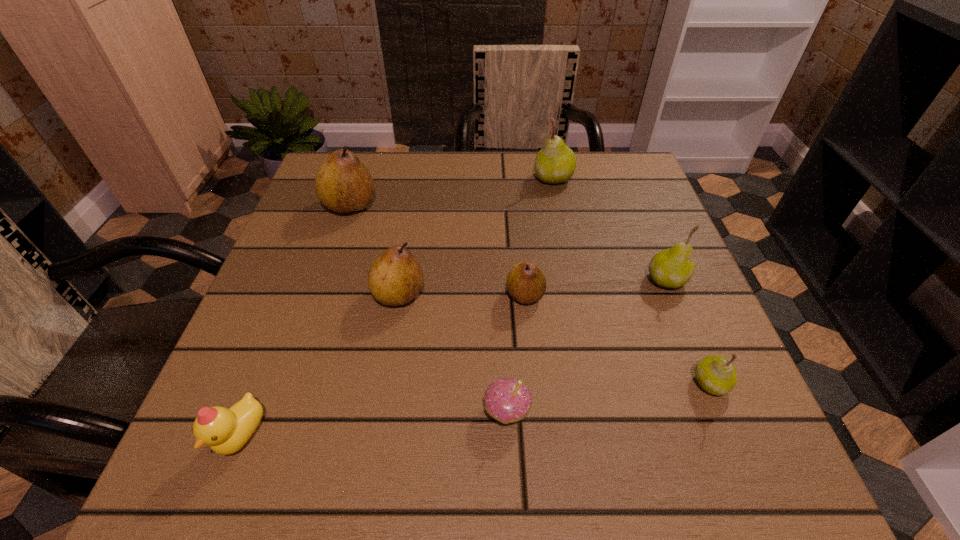
This screenshot has width=960, height=540. What are the coordinates of `the nearest green pear` in the screenshot? It's located at (716, 375).

Locate an element on the screen. pink cupcake is located at coordinates (507, 400).

Identify the location of duckling. (226, 431).

You are a GUI agent. You are given a task and a screenshot of the screen. Output one action in this format:
    pyautogui.click(x=<x>, y=<y>)
    Task: Click on the vacant point located 0.400m on the front of the farthest object
    This screenshot has height=540, width=960.
    Given the screenshot: What is the action you would take?
    pyautogui.click(x=583, y=321)

Find the location of a particular element. Image resolution: width=960 pixels, height=540 pixels. vacant area situated on the front of the second farthest object is located at coordinates (293, 376).

Find the location of a particular element. This screenshot has height=540, width=960. free space located on the back of the second pear from left to right is located at coordinates (406, 252).

Find the location of a particular element. The image size is (960, 540). free space located 0.340m on the back of the second farthest green pear is located at coordinates (622, 172).

The width and height of the screenshot is (960, 540). I want to click on vacant region located on the back of the smallest brown pear, so click(x=514, y=172).

You are a GUI agent. You are given a task and a screenshot of the screen. Output one action in this format:
    pyautogui.click(x=<x>, y=<y>)
    Task: Click on the vacant space situated 0.370m on the left of the smallest green pear
    
    Given the screenshot: What is the action you would take?
    pyautogui.click(x=458, y=383)

What are the coordinates of `free space located 0.220m on the back of the cupcake` in the screenshot? It's located at (501, 287).